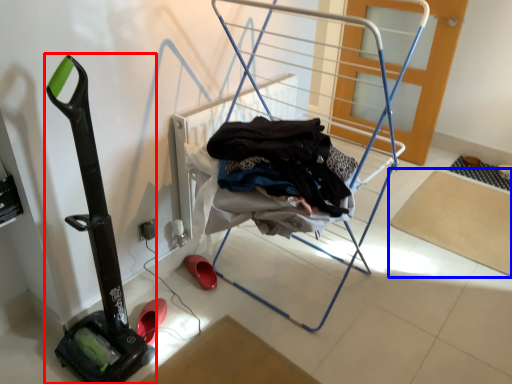
Question: Among these objects, which one is farthest to the camera, vacuum (highlighted by a red box) or yoga mat (highlighted by a blue box)?

Choices:
 (A) vacuum
 (B) yoga mat

Answer: (B)